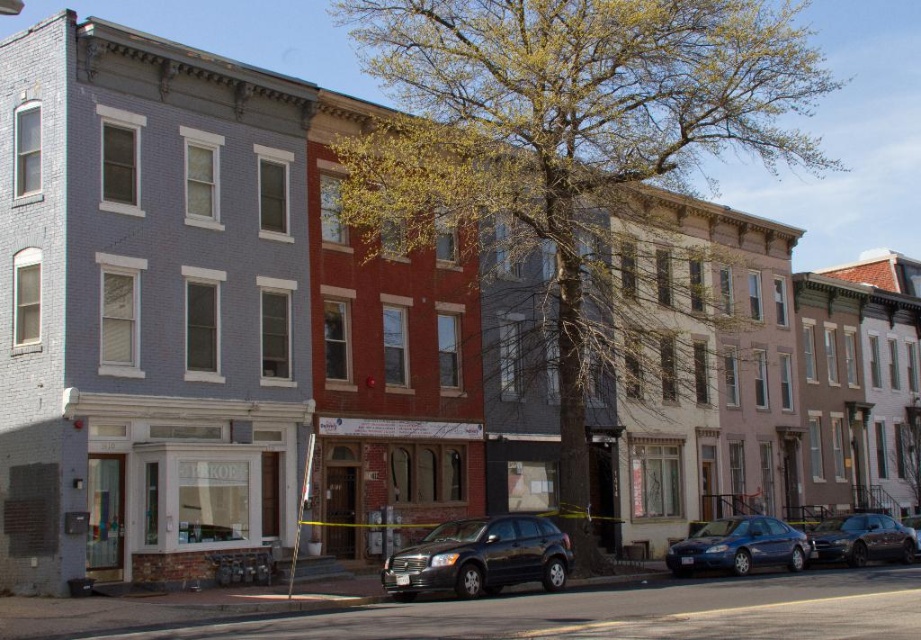
Between metallic blue sedan at lower right and shiny black sedan at lower right, which one has less height?

With less height is metallic blue sedan at lower right.

Can you confirm if metallic blue sedan at lower right is positioned below shiny black sedan at lower right?

No, metallic blue sedan at lower right is not below shiny black sedan at lower right.

Is point (764, 538) farther from viewer compared to point (879, 557)?

No.

Locate an element on the screen. Image resolution: width=921 pixels, height=640 pixels. metallic blue sedan at lower right is located at coordinates (739, 547).

Which is more to the left, green leafy tree at center or shiny black sedan at lower right?

From the viewer's perspective, green leafy tree at center appears more on the left side.

Is green leafy tree at center to the left of shiny black sedan at lower right from the viewer's perspective?

Yes, green leafy tree at center is to the left of shiny black sedan at lower right.

Which is in front, point (415, 90) or point (867, 538)?

Point (867, 538) is in front.

This screenshot has width=921, height=640. Find the location of `green leafy tree at center`. green leafy tree at center is located at coordinates [x=564, y=124].

Can you confirm if green leafy tree at center is positioned to the left of matte black suv at center?

Incorrect, green leafy tree at center is not on the left side of matte black suv at center.

Is point (732, 22) positioned before point (471, 576)?

No, it is behind (471, 576).

You are a GUI agent. You are given a task and a screenshot of the screen. Output one action in this format:
    pyautogui.click(x=<x>, y=<y>)
    Task: Click on the green leafy tree at center
    
    Given the screenshot: What is the action you would take?
    pyautogui.click(x=564, y=124)